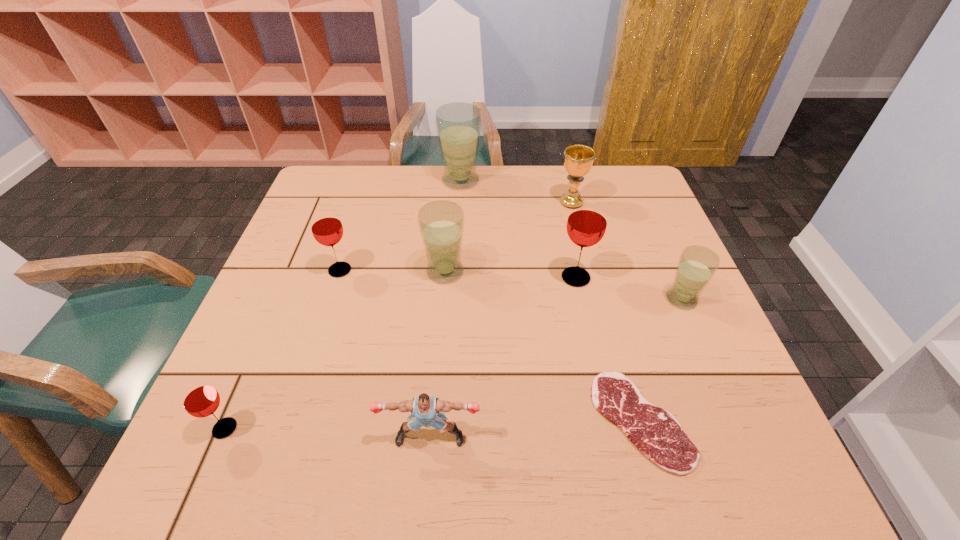
Identify the location of blue glass identified as the second closest to the chalice. This screenshot has height=540, width=960. (697, 265).

Where is `blue glass object that ranks as the third closest to the leftmost red glass`? The width and height of the screenshot is (960, 540). blue glass object that ranks as the third closest to the leftmost red glass is located at coordinates (697, 265).

Find the location of a particular element. vacant region that satisfies the following two spatial constraints: 1. on the back side of the gold chalice; 2. on the left side of the second red glass from left to right is located at coordinates (362, 202).

What are the coordinates of `vacant region that satisfies the following two spatial constraints: 1. on the back side of the nearest red glass; 2. on the left side of the smallest blue glass` in the screenshot? It's located at pyautogui.click(x=280, y=300).

Find the location of a particular element. The width and height of the screenshot is (960, 540). free space that satisfies the following two spatial constraints: 1. on the back side of the second farthest object; 2. on the left side of the second red glass from left to right is located at coordinates (362, 202).